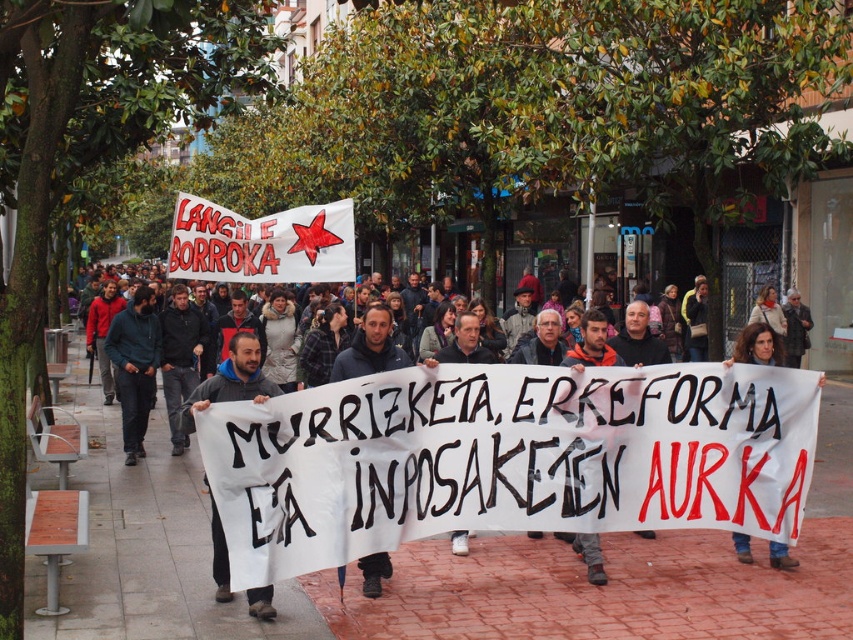
Question: Is dark gray hoodie at center to the right of jeans at center from the viewer's perspective?

Choices:
 (A) yes
 (B) no

Answer: (B)

Question: Can you confirm if dark gray hoodie at center is positioned to the right of black fabric banner at center?

Choices:
 (A) no
 (B) yes

Answer: (A)

Question: Which point is closer to the camera?

Choices:
 (A) (335, 376)
 (B) (216, 552)

Answer: (B)

Question: Is dark gray hoodie at center below black fabric banner at center?

Choices:
 (A) yes
 (B) no

Answer: (A)

Question: Estimate the real-world distances between objects in this image. Which object is farther from the jeans at center?

Choices:
 (A) dark gray hoodie at center
 (B) black fabric banner at center

Answer: (A)

Question: Which of the following is the closest to the observer?

Choices:
 (A) black fabric banner at center
 (B) jeans at center
 (C) dark blue hoodie at center
 (D) dark gray hoodie at center

Answer: (C)